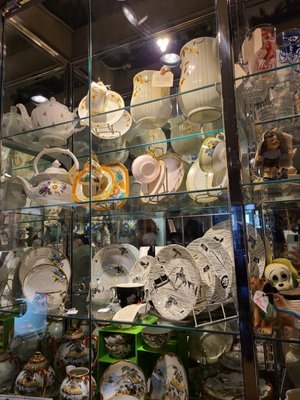
Where is `mirror backing to the shelf`? This screenshot has width=300, height=400. mirror backing to the shelf is located at coordinates (191, 232).